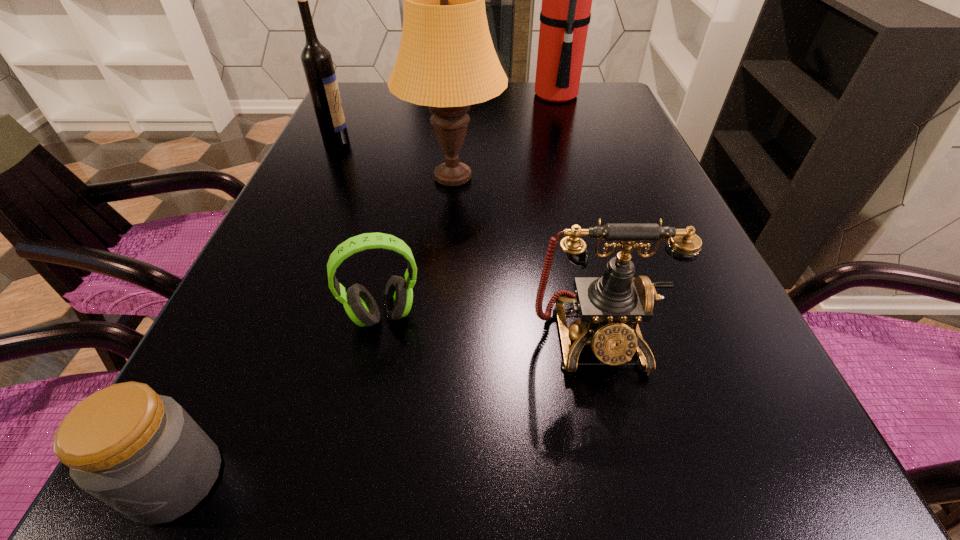
What are the coordinates of `vacant space located on the back of the lampshade` in the screenshot? It's located at [457, 124].

Find the location of a particular element. This screenshot has height=540, width=960. blank space located 0.120m on the label of the wine bottle is located at coordinates (396, 140).

I want to click on vacant area located 0.140m on the front of the fourth tallest object, featuring the rotary dial, so [628, 482].

Locate an element on the screen. The height and width of the screenshot is (540, 960). vacant space situated 0.240m on the front of the headset is located at coordinates (345, 502).

Find the location of a particular element. object at the far edge is located at coordinates (565, 15).

This screenshot has height=540, width=960. Find the location of `object at the near edge`. object at the near edge is located at coordinates (141, 453).

Find the location of a particular element. The width and height of the screenshot is (960, 540). wine bottle that is at the left edge is located at coordinates (317, 63).

In order to click on jar that is at the left edge in this screenshot , I will do `click(141, 453)`.

Where is `fire extinguisher situated at the right edge`? The image size is (960, 540). fire extinguisher situated at the right edge is located at coordinates (565, 15).

The image size is (960, 540). Identify the location of telephone that is positioned at the right edge. (610, 307).